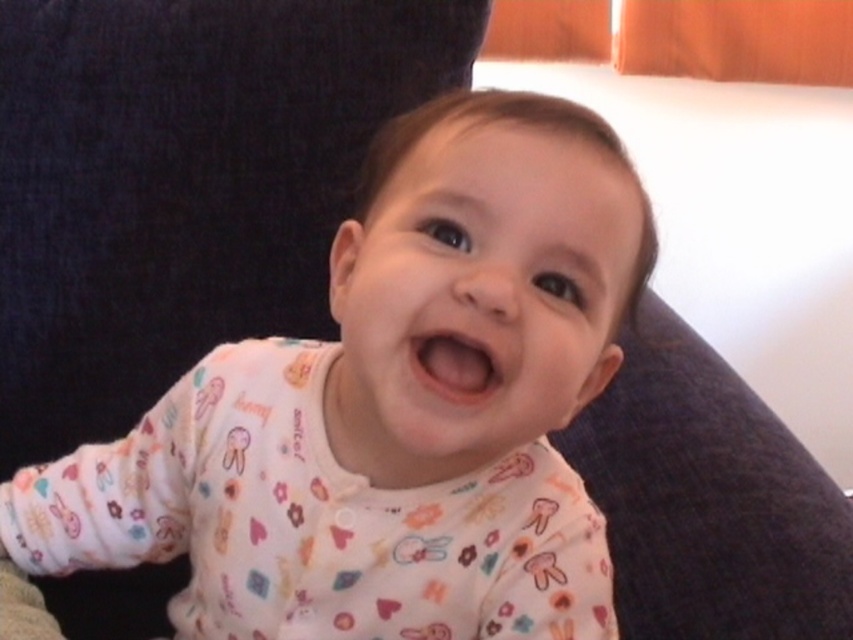
Question: Which object is closer to the camera taking this photo?

Choices:
 (A) white soft fabric baby at center
 (B) pink smooth mouth at center

Answer: (A)

Question: Does white soft fabric baby at center appear under pink smooth mouth at center?

Choices:
 (A) yes
 (B) no

Answer: (A)

Question: Is white soft fabric baby at center to the right of pink smooth mouth at center from the viewer's perspective?

Choices:
 (A) yes
 (B) no

Answer: (B)

Question: Which point is farther to the camera?

Choices:
 (A) white soft fabric baby at center
 (B) pink smooth mouth at center

Answer: (B)

Question: Does white soft fabric baby at center appear over pink smooth mouth at center?

Choices:
 (A) yes
 (B) no

Answer: (B)

Question: Which point is closer to the camera?

Choices:
 (A) (415, 374)
 (B) (239, 428)

Answer: (A)